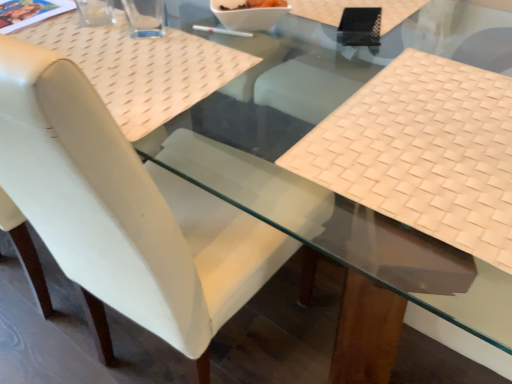
The width and height of the screenshot is (512, 384). In order to click on vacant area that is in front of transparent glass cup at upper left, the second clear positioned from the right in this screenshot , I will do `click(94, 46)`.